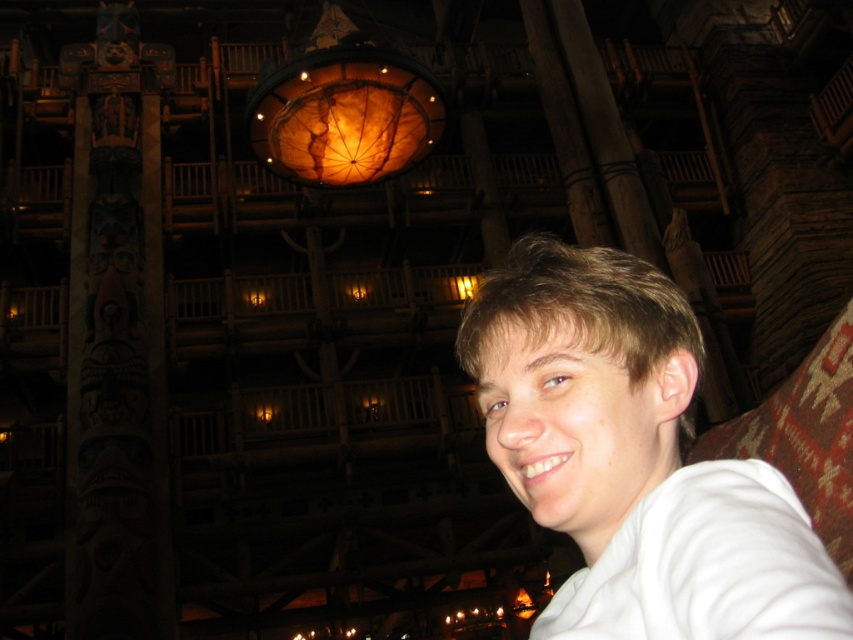
Question: Which object is closer to the camera taking this photo?

Choices:
 (A) translucent amber glass at center
 (B) white matte shirt at center

Answer: (B)

Question: Is white matte shirt at center above translucent amber glass at center?

Choices:
 (A) no
 (B) yes

Answer: (A)

Question: Which point is closer to the camera taking this photo?

Choices:
 (A) (402, 97)
 (B) (648, 365)

Answer: (B)

Question: Can you confirm if white matte shirt at center is smaller than translucent amber glass at center?

Choices:
 (A) no
 (B) yes

Answer: (B)

Question: Among these points, which one is nearest to the camera?

Choices:
 (A) (671, 355)
 (B) (341, 92)

Answer: (A)

Question: Can you confirm if white matte shirt at center is wider than translucent amber glass at center?

Choices:
 (A) no
 (B) yes

Answer: (A)